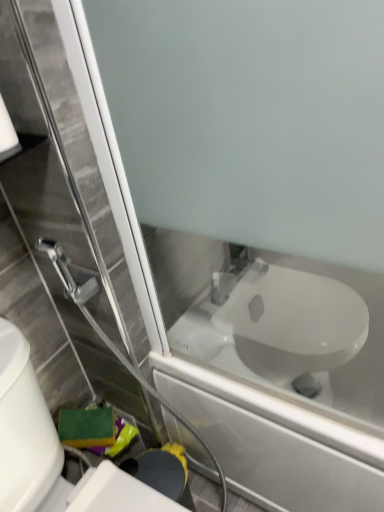
Question: Considering the relative sizes of white glossy toilet at lower right and white matte toilet paper at upper left in the image provided, is white glossy toilet at lower right smaller than white matte toilet paper at upper left?

Choices:
 (A) no
 (B) yes

Answer: (A)

Question: From a real-world perspective, is white glossy toilet at lower right over white matte toilet paper at upper left?

Choices:
 (A) yes
 (B) no

Answer: (B)

Question: From a real-world perspective, is white glossy toilet at lower right beneath white matte toilet paper at upper left?

Choices:
 (A) no
 (B) yes

Answer: (B)

Question: From the image's perspective, would you say white glossy toilet at lower right is shown under white matte toilet paper at upper left?

Choices:
 (A) no
 (B) yes

Answer: (B)

Question: Is white glossy toilet at lower right turned away from white matte toilet paper at upper left?

Choices:
 (A) yes
 (B) no

Answer: (B)

Question: In terms of height, does white matte toilet paper at upper left look taller or shorter compared to white glossy toilet at lower right?

Choices:
 (A) short
 (B) tall

Answer: (A)

Question: Do you think white matte toilet paper at upper left is within white glossy toilet at lower right, or outside of it?

Choices:
 (A) inside
 (B) outside

Answer: (B)

Question: From the image's perspective, is white matte toilet paper at upper left above or below white glossy toilet at lower right?

Choices:
 (A) below
 (B) above

Answer: (B)

Question: Based on their sizes in the image, would you say white matte toilet paper at upper left is bigger or smaller than white glossy toilet at lower right?

Choices:
 (A) big
 (B) small

Answer: (B)

Question: Does point [x=6, y=443] appear closer or farther from the camera than point [x=380, y=426]?

Choices:
 (A) closer
 (B) farther

Answer: (A)

Question: From the image's perspective, relative to white glossy toilet at center, is white glossy toilet at lower right above or below?

Choices:
 (A) below
 (B) above

Answer: (A)

Question: Based on their sizes in the image, would you say white glossy toilet at lower right is bigger or smaller than white glossy toilet at center?

Choices:
 (A) small
 (B) big

Answer: (A)

Question: Is white glossy toilet at lower right wider or thinner than white glossy toilet at center?

Choices:
 (A) wide
 (B) thin

Answer: (B)

Question: Is white glossy toilet at lower right in front of or behind white matte toilet paper at upper left in the image?

Choices:
 (A) behind
 (B) front

Answer: (B)

Question: Considering the positions of white glossy toilet at lower right and white matte toilet paper at upper left in the image, is white glossy toilet at lower right taller or shorter than white matte toilet paper at upper left?

Choices:
 (A) short
 (B) tall

Answer: (B)